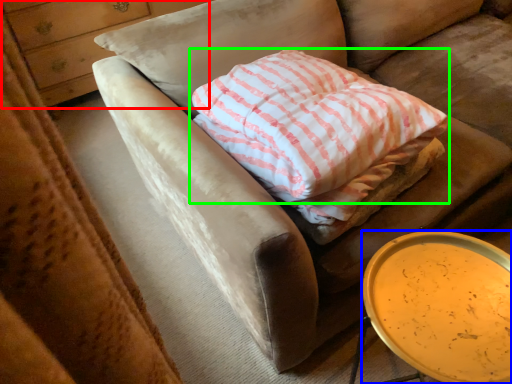
Question: Which object is the closest to the dresser (highlighted by a red box)? Choose among these: table (highlighted by a blue box) or pillow (highlighted by a green box).

Choices:
 (A) table
 (B) pillow

Answer: (B)